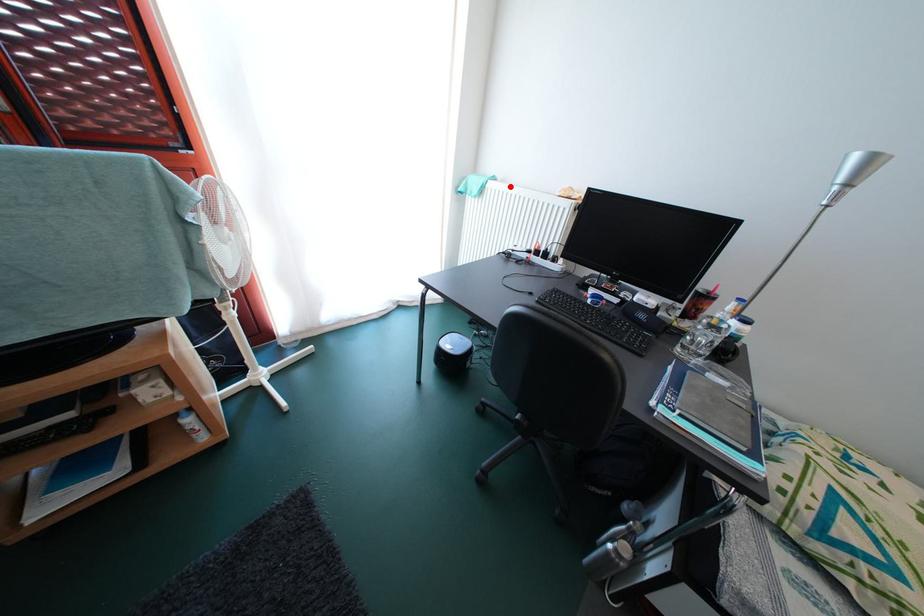
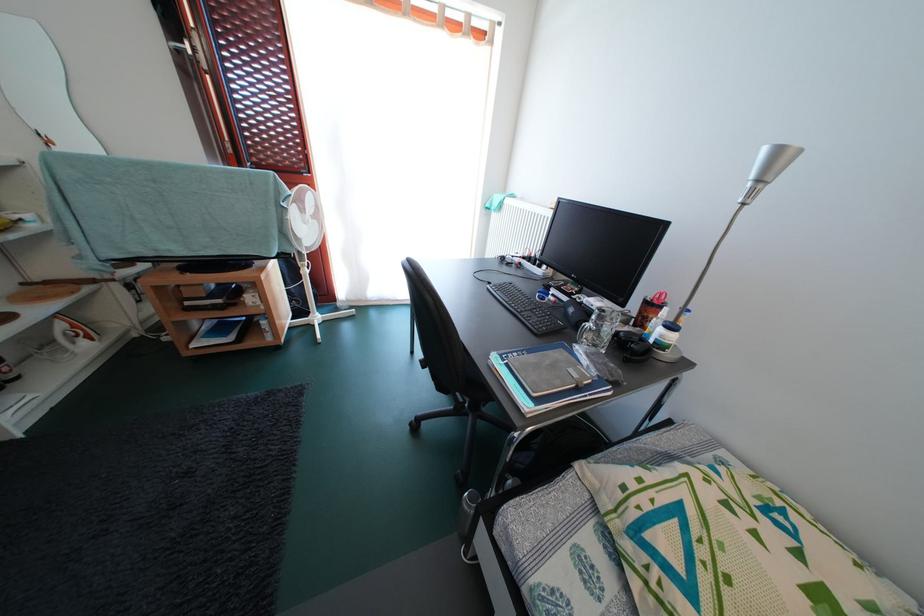
In the second image, find the point that corresponds to the highlighted location in the first image.

(529, 204)